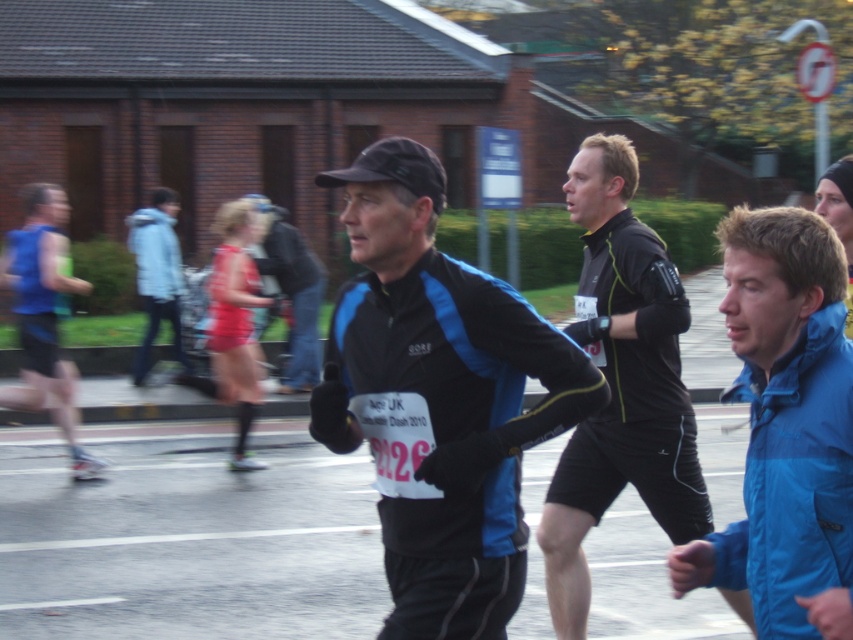
You are a photographer at the marathon and need to decide which jacket to wear for the event. The black matte jacket at center and the blue fabric jacket at center are both available. Based on their thickness, which one would be better suited for cooler weather?

The blue fabric jacket at center is better suited for cooler weather because it is thicker than the black matte jacket at center.

You are a photographer standing in the middle of the running event scene. You want to take a photo that includes both the point at coordinates point (834, 428) and point (234, 284). Which point should you focus on first to ensure both are in focus?

You should focus on point (834, 428) first because it is closer to you than point (234, 284). This way, the depth of field will likely cover both points effectively.